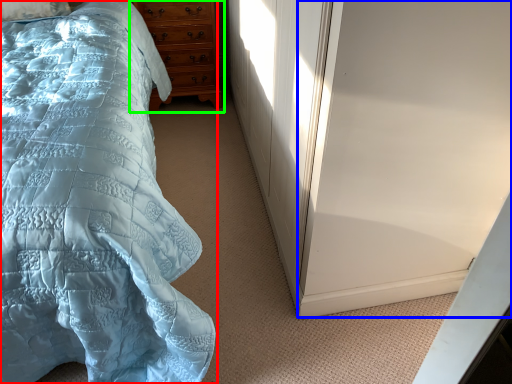
Question: Estimate the real-world distances between objects in this image. Which object is farther from bed (highlighted by a red box), screen door (highlighted by a blue box) or chest of drawers (highlighted by a green box)?

Choices:
 (A) screen door
 (B) chest of drawers

Answer: (B)